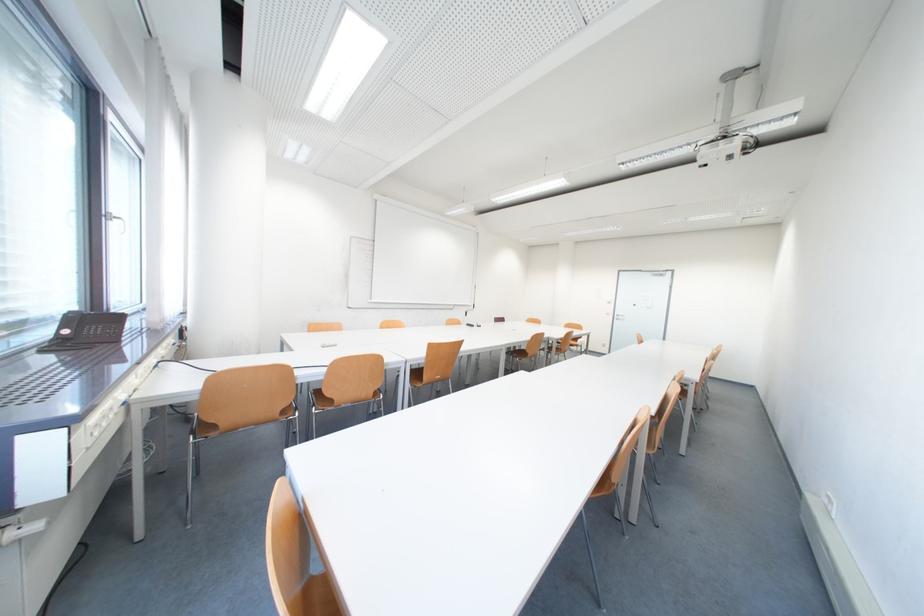
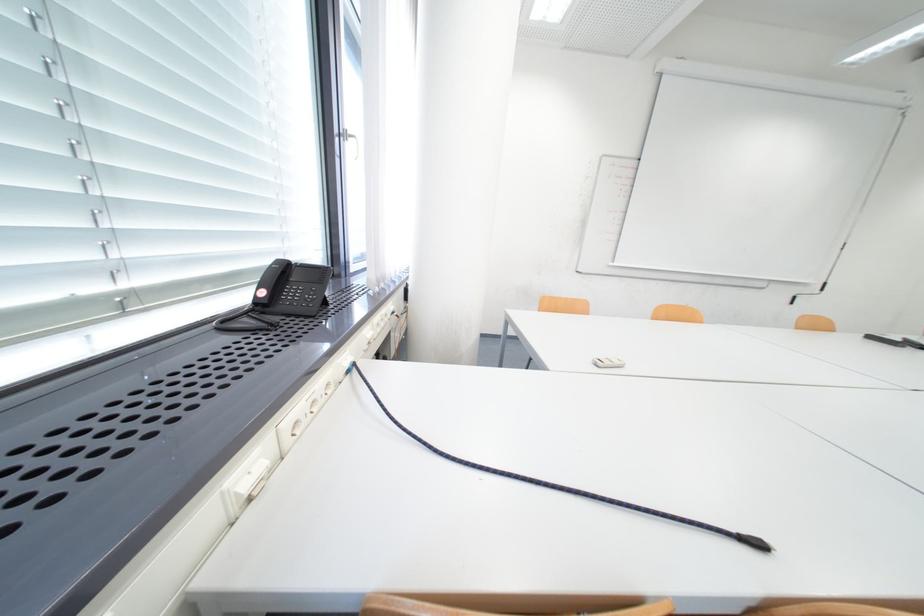
The point at [77,333] is marked in the first image. Where is the corresponding point in the second image?

(274, 294)